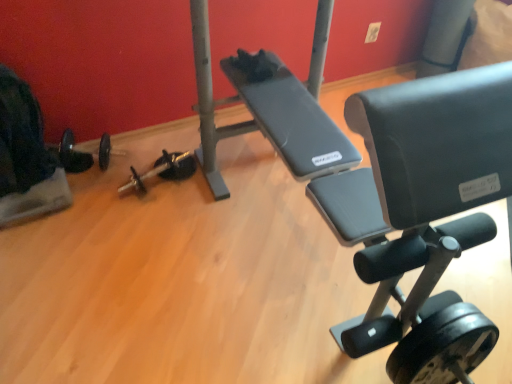
Question: Looking at the image, does black rubber dumbbell at center, the second dumbbell in the left-to-right sequence, seem bigger or smaller compared to velvet black swivel chair at left?

Choices:
 (A) small
 (B) big

Answer: (A)

Question: Is black rubber dumbbell at center, positioned as the third dumbbell in bottom-to-top order, taller or shorter than velvet black swivel chair at left?

Choices:
 (A) short
 (B) tall

Answer: (A)

Question: Which of these objects is positioned closest to the white matte pole at upper right?

Choices:
 (A) black rubber dumbbell at lower left, the third dumbbell from the right
 (B) black rubber dumbbell at center, positioned as the 2th dumbbell in right-to-left order
 (C) black rubber dumbbell at lower right, acting as the first dumbbell starting from the bottom
 (D) velvet black swivel chair at left
 (E) black rubber barbell at lower left

Answer: (B)

Question: Which of these objects is positioned closest to the black rubber barbell at lower left?

Choices:
 (A) black rubber dumbbell at lower right, the 3th dumbbell when ordered from back to front
 (B) white matte pole at upper right
 (C) black rubber dumbbell at center, positioned as the third dumbbell in bottom-to-top order
 (D) velvet black swivel chair at left
 (E) black rubber dumbbell at lower left, placed as the 2th dumbbell when sorted from bottom to top

Answer: (D)